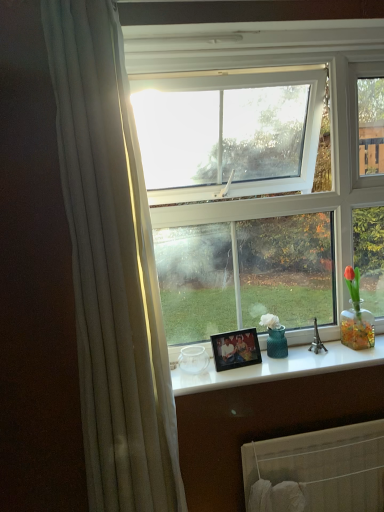
Where is `white glossy counter top at center`? The width and height of the screenshot is (384, 512). white glossy counter top at center is located at coordinates (279, 367).

This screenshot has height=512, width=384. What do you see at coordinates (236, 349) in the screenshot?
I see `wooden photo frame at center` at bounding box center [236, 349].

What are the coordinates of `white fabric radiator at lower center` in the screenshot? It's located at (317, 471).

Who is taller, white glossy counter top at center or wooden photo frame at center?

wooden photo frame at center is taller.

Between white glossy counter top at center and wooden photo frame at center, which one has smaller width?

Thinner between the two is wooden photo frame at center.

Is white glossy counter top at center oriented away from wooden photo frame at center?

white glossy counter top at center is not turned away from wooden photo frame at center.

From the image's perspective, relative to wooden photo frame at center, is white glossy counter top at center above or below?

Based on their image positions, white glossy counter top at center is located beneath wooden photo frame at center.

From the image's perspective, which is above, white fabric radiator at lower center or white glossy counter top at center?

white glossy counter top at center.

Does point (353, 476) come in front of point (292, 374)?

No, (353, 476) is behind (292, 374).

Locate an element on the screen. The image size is (384, 512). radiator below the white glossy counter top at center (from the image's perspective) is located at coordinates (317, 471).

In the scene shown: Is white fabric radiator at lower center bigger than white glossy counter top at center?

Correct, white fabric radiator at lower center is larger in size than white glossy counter top at center.

Could wooden photo frame at center be considered to be inside white fabric radiator at lower center?

No, wooden photo frame at center is not surrounded by white fabric radiator at lower center.

From the image's perspective, between white fabric radiator at lower center and wooden photo frame at center, who is located below?

white fabric radiator at lower center, from the image's perspective.

Does white fabric radiator at lower center have a lesser height compared to wooden photo frame at center?

In fact, white fabric radiator at lower center may be taller than wooden photo frame at center.

Does point (308, 479) come closer to viewer compared to point (235, 358)?

Yes, point (308, 479) is closer to viewer.

Choose the correct answer: Is wooden photo frame at center inside white glossy counter top at center or outside it?

wooden photo frame at center is located beyond the bounds of white glossy counter top at center.

Based on the photo, based on their positions, is wooden photo frame at center located to the left or right of white glossy counter top at center?

Based on their positions, wooden photo frame at center is located to the left of white glossy counter top at center.

From a real-world perspective, which object rests below the other?

white glossy counter top at center, from a real-world perspective.

You are a GUI agent. You are given a task and a screenshot of the screen. Output one action in this format:
    pyautogui.click(x=<x>, y=<y>)
    Task: Click on the counter top below the wooden photo frame at center (from the image's perspective)
    The image size is (384, 512).
    Given the screenshot: What is the action you would take?
    pyautogui.click(x=279, y=367)

Is wooden photo frame at center beside white fabric radiator at lower center?

No, wooden photo frame at center is not next to white fabric radiator at lower center.

The height and width of the screenshot is (512, 384). I want to click on picture frame lying behind the white fabric radiator at lower center, so click(236, 349).

Do you think wooden photo frame at center is within white fabric radiator at lower center, or outside of it?

wooden photo frame at center is not inside white fabric radiator at lower center, it's outside.

Is point (214, 338) closer or farther from the camera than point (285, 504)?

Point (214, 338) is farther from the camera than point (285, 504).

Is white glossy counter top at center positioned with its back to white fabric radiator at lower center?

white glossy counter top at center does not have its back to white fabric radiator at lower center.

From the image's perspective, is white glossy counter top at center beneath white fabric radiator at lower center?

No.

Can you see white glossy counter top at center touching white fabric radiator at lower center?

white glossy counter top at center and white fabric radiator at lower center are not in contact.

Can you confirm if white glossy counter top at center is shorter than white fabric radiator at lower center?

Indeed, white glossy counter top at center has a lesser height compared to white fabric radiator at lower center.

This screenshot has height=512, width=384. In order to click on counter top in front of the wooden photo frame at center in this screenshot , I will do `click(279, 367)`.

Image resolution: width=384 pixels, height=512 pixels. I want to click on radiator below the white glossy counter top at center (from the image's perspective), so click(x=317, y=471).

From the image, which object appears to be farther from white glossy counter top at center, white fabric radiator at lower center or wooden photo frame at center?

white fabric radiator at lower center lies further to white glossy counter top at center than the other object.

Estimate the real-world distances between objects in this image. Which object is further from white fabric radiator at lower center, wooden photo frame at center or white glossy counter top at center?

wooden photo frame at center.

Looking at the image, which one is located further to wooden photo frame at center, white fabric radiator at lower center or white glossy counter top at center?

Among the two, white fabric radiator at lower center is located further to wooden photo frame at center.

Estimate the real-world distances between objects in this image. Which object is further from white glossy counter top at center, wooden photo frame at center or white fabric radiator at lower center?

Based on the image, white fabric radiator at lower center appears to be further to white glossy counter top at center.

Considering their positions, is white glossy counter top at center positioned further to white fabric radiator at lower center than wooden photo frame at center?

Based on the image, wooden photo frame at center appears to be further to white fabric radiator at lower center.

Which object lies nearer to the anchor point wooden photo frame at center, white glossy counter top at center or white fabric radiator at lower center?

white glossy counter top at center lies closer to wooden photo frame at center than the other object.

I want to click on counter top between wooden photo frame at center and white fabric radiator at lower center in the up-down direction, so click(x=279, y=367).